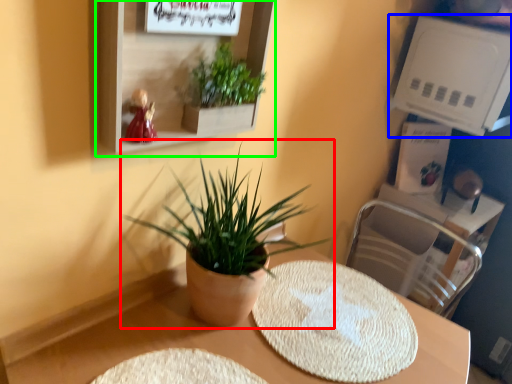
Question: Which object is the farthest from houseplant (highlighted by a red box)? Choose among these: shelf (highlighted by a blue box) or shelf (highlighted by a green box).

Choices:
 (A) shelf
 (B) shelf

Answer: (A)